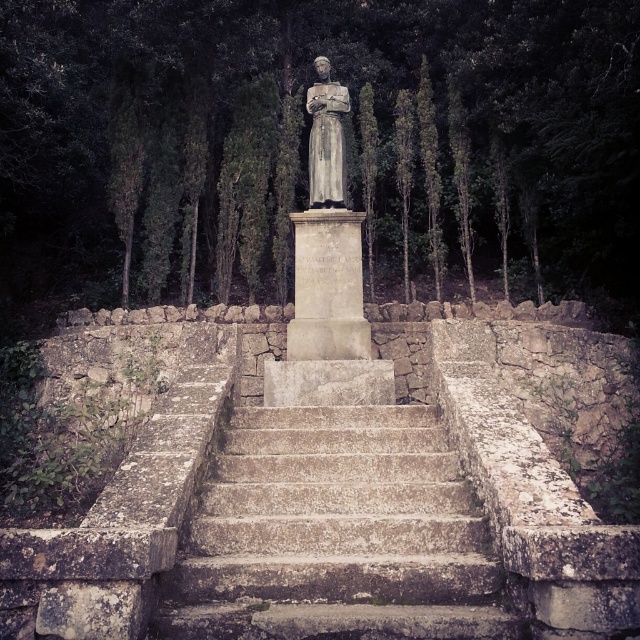
You are standing at the base of the stone steps leading to the statue. There is a point marked at coordinates (336, 534). Based on the scene description, where is this point located?

The point at coordinates (336, 534) is on the rusty stone stairs at center.

You are a gardener who needs to water the green leafy trees at center and the rusty stone stairs at center. Your watering can has a range of 15 meters. Can you water both from your current position without moving?

The green leafy trees at center and the rusty stone stairs at center are 15.17 meters apart from each other. Since your watering can only reaches 15 meters, you cannot water both without moving closer to either the trees or the stairs.

You are standing at the base of the stone steps and want to reach the statue. There are green leafy trees at center and rusty stone stairs at center in your view. Which object should you focus on to ascend towards the statue?

You should focus on the rusty stone stairs at center to ascend towards the statue since they are the steps leading up to the pedestal where the statue stands, while the green leafy trees at center are positioned to the left of the stairs and not part of the path.